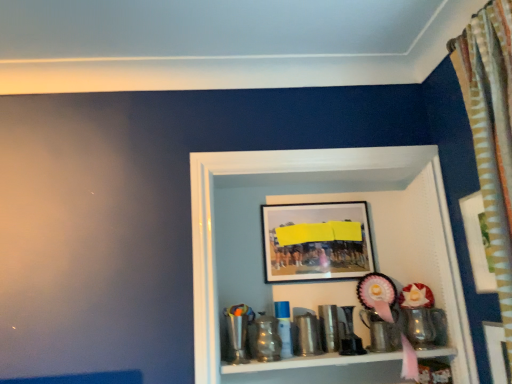
Find the location of a particular element. The width and height of the screenshot is (512, 384). metallic trophy at center is located at coordinates (326, 282).

What is the approximate height of matte black picture frame at upper center, the first picture frame viewed from the left?

12.40 inches.

This screenshot has height=384, width=512. What are the coordinates of `wooden picture frame at upper right, positioned as the first picture frame in right-to-left order` in the screenshot? It's located at pyautogui.click(x=478, y=242).

What do you see at coordinates (478, 242) in the screenshot?
I see `wooden picture frame at upper right, marked as the 2th picture frame in a back-to-front arrangement` at bounding box center [478, 242].

Find the location of `metallic trophy at center`. metallic trophy at center is located at coordinates (326, 282).

Does wooden picture frame at upper right, which is the 1th picture frame from front to back, appear on the left side of matte black picture frame at upper center, the second picture frame positioned from the front?

In fact, wooden picture frame at upper right, which is the 1th picture frame from front to back, is to the right of matte black picture frame at upper center, the second picture frame positioned from the front.

Would you say wooden picture frame at upper right, which is the 1th picture frame from front to back, is outside matte black picture frame at upper center, arranged as the second picture frame when viewed from the right?

Indeed, wooden picture frame at upper right, which is the 1th picture frame from front to back, is completely outside matte black picture frame at upper center, arranged as the second picture frame when viewed from the right.

From the image's perspective, which is above, wooden picture frame at upper right, marked as the 2th picture frame in a back-to-front arrangement, or matte black picture frame at upper center, the first picture frame when ordered from back to front?

wooden picture frame at upper right, marked as the 2th picture frame in a back-to-front arrangement, is shown above in the image.

Is wooden picture frame at upper right, positioned as the first picture frame in right-to-left order, wider than matte black picture frame at upper center, the second picture frame positioned from the front?

In fact, wooden picture frame at upper right, positioned as the first picture frame in right-to-left order, might be narrower than matte black picture frame at upper center, the second picture frame positioned from the front.

Is matte black picture frame at upper center, the second picture frame positioned from the front, aimed at metallic trophy at center?

Yes, matte black picture frame at upper center, the second picture frame positioned from the front, is facing metallic trophy at center.

Is matte black picture frame at upper center, the first picture frame when ordered from back to front, far away from metallic trophy at center?

They are positioned close to each other.

Considering the positions of objects matte black picture frame at upper center, the first picture frame when ordered from back to front, and metallic trophy at center in the image provided, who is more to the right, matte black picture frame at upper center, the first picture frame when ordered from back to front, or metallic trophy at center?

matte black picture frame at upper center, the first picture frame when ordered from back to front.

Is metallic shiny cup at lower center, which is the first toy in left-to-right order, looking in the opposite direction of matte black picture frame at upper center, the first picture frame when ordered from back to front?

No, matte black picture frame at upper center, the first picture frame when ordered from back to front, is not at the back of metallic shiny cup at lower center, which is the first toy in left-to-right order.

From a real-world perspective, between metallic shiny cup at lower center, which is the first toy in left-to-right order, and matte black picture frame at upper center, the first picture frame viewed from the left, who is vertically lower?

metallic shiny cup at lower center, which is the first toy in left-to-right order, is physically lower.

Relative to matte black picture frame at upper center, the second picture frame positioned from the front, is metallic shiny cup at lower center, the second toy viewed from the right, in front or behind?

metallic shiny cup at lower center, the second toy viewed from the right, is in front of matte black picture frame at upper center, the second picture frame positioned from the front.

Who is shorter, matte black picture frame at upper center, the first picture frame when ordered from back to front, or wooden picture frame at upper right, marked as the 2th picture frame in a back-to-front arrangement?

matte black picture frame at upper center, the first picture frame when ordered from back to front, is shorter.

Which is behind, matte black picture frame at upper center, the second picture frame positioned from the front, or wooden picture frame at upper right, positioned as the first picture frame in right-to-left order?

matte black picture frame at upper center, the second picture frame positioned from the front, is further away from the camera.

Is wooden picture frame at upper right, marked as the 2th picture frame in a left-to-right arrangement, completely or partially inside matte black picture frame at upper center, arranged as the second picture frame when viewed from the right?

Actually, wooden picture frame at upper right, marked as the 2th picture frame in a left-to-right arrangement, is outside matte black picture frame at upper center, arranged as the second picture frame when viewed from the right.

Can you confirm if matte black picture frame at upper center, arranged as the second picture frame when viewed from the right, is thinner than wooden picture frame at upper right, marked as the 2th picture frame in a back-to-front arrangement?

In fact, matte black picture frame at upper center, arranged as the second picture frame when viewed from the right, might be wider than wooden picture frame at upper right, marked as the 2th picture frame in a back-to-front arrangement.

Considering the positions of objects metallic silver cup at lower right, which is counted as the second toy, starting from the left, and wooden picture frame at upper right, marked as the 2th picture frame in a back-to-front arrangement, in the image provided, who is in front, metallic silver cup at lower right, which is counted as the second toy, starting from the left, or wooden picture frame at upper right, marked as the 2th picture frame in a back-to-front arrangement,?

wooden picture frame at upper right, marked as the 2th picture frame in a back-to-front arrangement.

Can you see metallic silver cup at lower right, the first toy when ordered from right to left, touching wooden picture frame at upper right, which is the 1th picture frame from front to back?

metallic silver cup at lower right, the first toy when ordered from right to left, and wooden picture frame at upper right, which is the 1th picture frame from front to back, are clearly separated.

Would you say metallic silver cup at lower right, the first toy when ordered from right to left, contains wooden picture frame at upper right, which is the 1th picture frame from front to back?

No, wooden picture frame at upper right, which is the 1th picture frame from front to back, is not surrounded by metallic silver cup at lower right, the first toy when ordered from right to left.

From the image's perspective, which object appears higher, metallic silver cup at lower right, which is counted as the second toy, starting from the left, or matte black picture frame at upper center, the second picture frame positioned from the front?

matte black picture frame at upper center, the second picture frame positioned from the front, from the image's perspective.

Does metallic silver cup at lower right, the first toy when ordered from right to left, turn towards matte black picture frame at upper center, the first picture frame when ordered from back to front?

No.

Between metallic silver cup at lower right, the first toy when ordered from right to left, and matte black picture frame at upper center, arranged as the second picture frame when viewed from the right, which one has smaller size?

metallic silver cup at lower right, the first toy when ordered from right to left, is smaller.

Between metallic silver cup at lower right, which is counted as the second toy, starting from the left, and matte black picture frame at upper center, the first picture frame viewed from the left, which one appears on the right side from the viewer's perspective?

Positioned to the right is metallic silver cup at lower right, which is counted as the second toy, starting from the left.

From a real-world perspective, relative to wooden picture frame at upper right, positioned as the first picture frame in right-to-left order, is metallic shiny cup at lower center, the second toy viewed from the right, vertically above or below?

metallic shiny cup at lower center, the second toy viewed from the right, is below wooden picture frame at upper right, positioned as the first picture frame in right-to-left order.

Which of these two, metallic shiny cup at lower center, the second toy viewed from the right, or wooden picture frame at upper right, which is the 1th picture frame from front to back, is wider?

With larger width is metallic shiny cup at lower center, the second toy viewed from the right.

From the image's perspective, which one is positioned higher, metallic shiny cup at lower center, the second toy viewed from the right, or wooden picture frame at upper right, marked as the 2th picture frame in a back-to-front arrangement?

wooden picture frame at upper right, marked as the 2th picture frame in a back-to-front arrangement, appears higher in the image.

Find the location of `picture frame to the left of wooden picture frame at upper right, which is the 1th picture frame from front to back`. picture frame to the left of wooden picture frame at upper right, which is the 1th picture frame from front to back is located at coordinates (316, 241).

The image size is (512, 384). In the image, there is a matte black picture frame at upper center, arranged as the second picture frame when viewed from the right. What are the coordinates of `shelf below it (from a real-world perspective)` in the screenshot? It's located at (326, 282).

Based on their spatial positions, is matte black picture frame at upper center, the second picture frame positioned from the front, or metallic trophy at center closer to metallic shiny cup at lower center, the second toy viewed from the right?

Based on the image, matte black picture frame at upper center, the second picture frame positioned from the front, appears to be nearer to metallic shiny cup at lower center, the second toy viewed from the right.

Which object lies nearer to the anchor point metallic silver cup at lower right, which is counted as the second toy, starting from the left, metallic shiny cup at lower center, the second toy viewed from the right, or metallic trophy at center?

metallic trophy at center is positioned closer to the anchor metallic silver cup at lower right, which is counted as the second toy, starting from the left.

Estimate the real-world distances between objects in this image. Which object is further from metallic shiny cup at lower center, the second toy viewed from the right, wooden picture frame at upper right, which is the 1th picture frame from front to back, or metallic trophy at center?

wooden picture frame at upper right, which is the 1th picture frame from front to back, is positioned further to the anchor metallic shiny cup at lower center, the second toy viewed from the right.

Considering their positions, is matte black picture frame at upper center, arranged as the second picture frame when viewed from the right, positioned closer to wooden picture frame at upper right, positioned as the first picture frame in right-to-left order, than metallic silver cup at lower right, the first toy when ordered from right to left?

Among the two, metallic silver cup at lower right, the first toy when ordered from right to left, is located nearer to wooden picture frame at upper right, positioned as the first picture frame in right-to-left order.

Which object lies nearer to the anchor point metallic shiny cup at lower center, the second toy viewed from the right, wooden picture frame at upper right, positioned as the first picture frame in right-to-left order, or matte black picture frame at upper center, arranged as the second picture frame when viewed from the right?

matte black picture frame at upper center, arranged as the second picture frame when viewed from the right.

When comparing their distances from metallic shiny cup at lower center, the second toy viewed from the right, does metallic trophy at center or matte black picture frame at upper center, the first picture frame viewed from the left, seem closer?

Among the two, matte black picture frame at upper center, the first picture frame viewed from the left, is located nearer to metallic shiny cup at lower center, the second toy viewed from the right.

From the image, which object appears to be nearer to metallic shiny cup at lower center, which is the first toy in left-to-right order, metallic silver cup at lower right, which is counted as the second toy, starting from the left, or metallic trophy at center?

metallic trophy at center lies closer to metallic shiny cup at lower center, which is the first toy in left-to-right order, than the other object.

Based on their spatial positions, is matte black picture frame at upper center, the second picture frame positioned from the front, or metallic shiny cup at lower center, the second toy viewed from the right, closer to wooden picture frame at upper right, positioned as the first picture frame in right-to-left order?

The object closer to wooden picture frame at upper right, positioned as the first picture frame in right-to-left order, is matte black picture frame at upper center, the second picture frame positioned from the front.

The height and width of the screenshot is (384, 512). I want to click on toy between metallic trophy at center and wooden picture frame at upper right, marked as the 2th picture frame in a back-to-front arrangement, from left to right, so click(421, 317).

Where is `shelf between metallic shiny cup at lower center, which is the first toy in left-to-right order, and matte black picture frame at upper center, the second picture frame positioned from the front, in the horizontal direction`? shelf between metallic shiny cup at lower center, which is the first toy in left-to-right order, and matte black picture frame at upper center, the second picture frame positioned from the front, in the horizontal direction is located at coordinates 326,282.

You are a GUI agent. You are given a task and a screenshot of the screen. Output one action in this format:
    pyautogui.click(x=<x>, y=<y>)
    Task: Click on the shelf located between metallic shiny cup at lower center, which is the first toy in left-to-right order, and metallic silver cup at lower right, which is counted as the second toy, starting from the left, in the left-right direction
    The image size is (512, 384).
    Given the screenshot: What is the action you would take?
    pyautogui.click(x=326, y=282)

Image resolution: width=512 pixels, height=384 pixels. Identify the location of picture frame between metallic trophy at center and wooden picture frame at upper right, marked as the 2th picture frame in a left-to-right arrangement, in the horizontal direction. (316, 241).